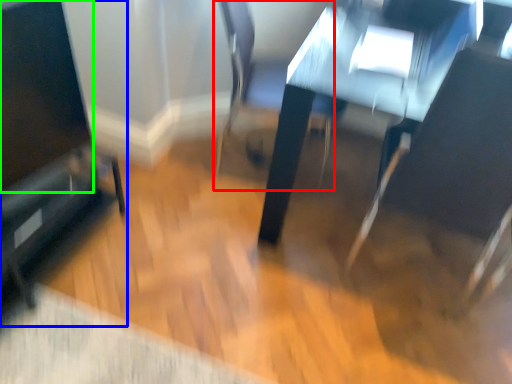
Question: Which object is the farthest from swivel chair (highlighted by a red box)? Choose among these: furniture (highlighted by a blue box) or screen (highlighted by a green box).

Choices:
 (A) furniture
 (B) screen

Answer: (B)